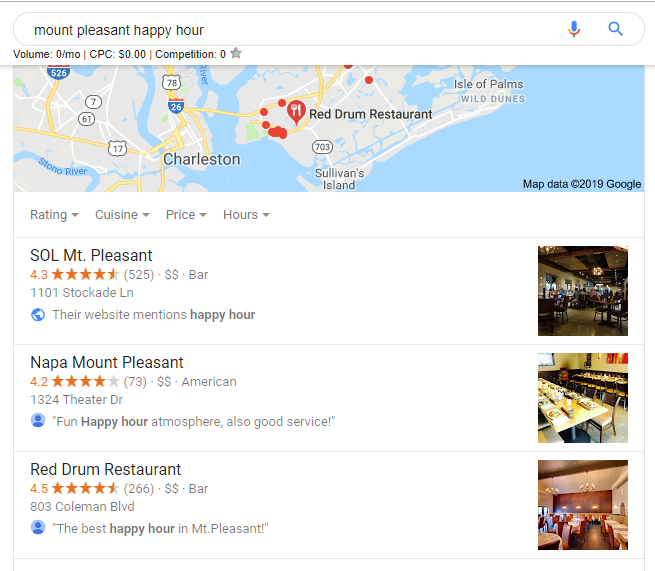
At what (x,y) coordinates should I click in order to perform the action: click on lighting. Please return your answer as a coordinate pair (x, y). Image resolution: width=655 pixels, height=571 pixels. Looking at the image, I should click on (585, 488).